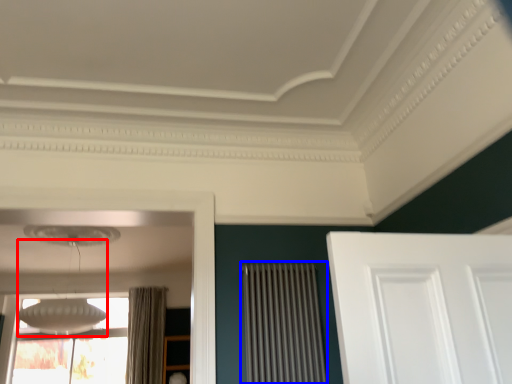
Question: Which object is further to the camera taking this photo, lamp (highlighted by a red box) or radiator (highlighted by a blue box)?

Choices:
 (A) lamp
 (B) radiator

Answer: (A)